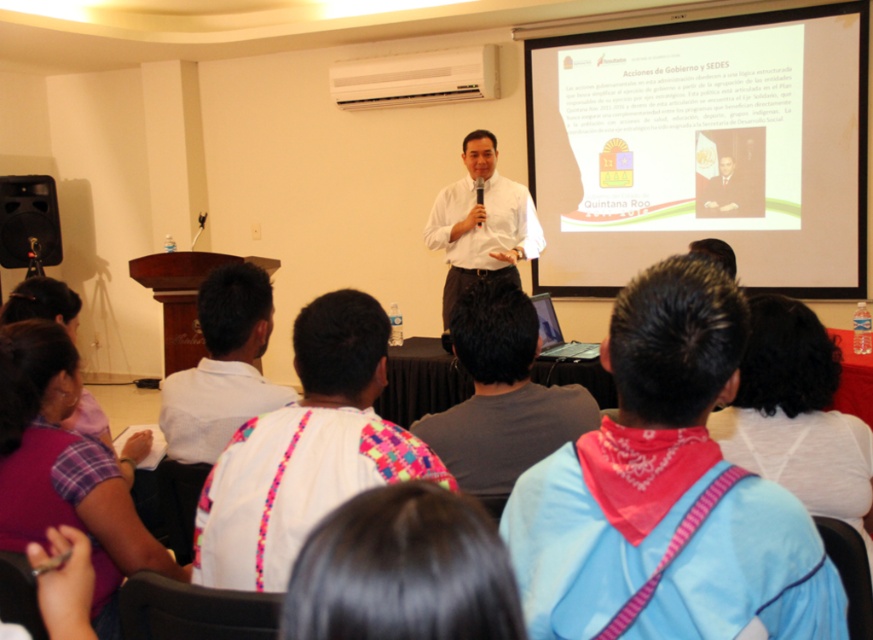
Question: Can you confirm if black hair at lower center is thinner than white smooth shirt at center?

Choices:
 (A) no
 (B) yes

Answer: (B)

Question: Which object is the farthest from the white smooth shirt at center?

Choices:
 (A) dark suit at center
 (B) white woven shirt at center
 (C) black matte speaker at left

Answer: (C)

Question: Can you confirm if white matte projector screen at upper right is positioned above dark gray shirt at center?

Choices:
 (A) no
 (B) yes

Answer: (B)

Question: Estimate the real-world distances between objects in this image. Which object is farther from the white fabric headscarf at upper center?

Choices:
 (A) black matte speaker at left
 (B) pink bandana at center
 (C) white woven shirt at center

Answer: (A)

Question: Which point is closer to the camera?

Choices:
 (A) 526,198
 (B) 292,515

Answer: (B)

Question: Is white matte projector screen at upper right thinner than dark suit at center?

Choices:
 (A) no
 (B) yes

Answer: (A)